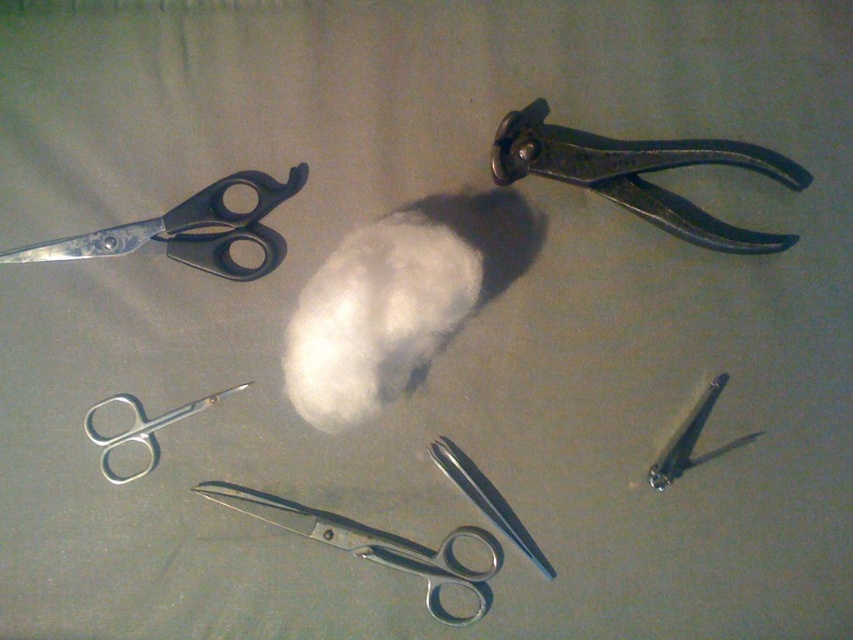
Can you confirm if dark gray metal pliers at upper right is bigger than silver metallic scissors at upper left?

Correct, dark gray metal pliers at upper right is larger in size than silver metallic scissors at upper left.

Between point (612, 177) and point (142, 420), which one is positioned in front?

Point (612, 177)

Which is in front, point (497, 161) or point (155, 417)?

Point (155, 417)

This screenshot has width=853, height=640. Identify the location of dark gray metal pliers at upper right. (639, 173).

From the picture: Does silver metallic scissors at upper left have a larger size compared to metallic silver nail at center?

Correct, silver metallic scissors at upper left is larger in size than metallic silver nail at center.

Is point (154, 440) behind point (677, 448)?

Yes, point (154, 440) is farther from viewer.

Describe the element at coordinates (142, 428) in the screenshot. I see `silver metallic scissors at upper left` at that location.

This screenshot has height=640, width=853. I want to click on silver metallic scissors at upper left, so click(x=142, y=428).

Between dark gray metal pliers at upper right and metallic scissors at center, which one has more height?

With more height is dark gray metal pliers at upper right.

Can you confirm if dark gray metal pliers at upper right is positioned to the right of metallic scissors at center?

Yes, dark gray metal pliers at upper right is to the right of metallic scissors at center.

Where is `dark gray metal pliers at upper right`? The image size is (853, 640). dark gray metal pliers at upper right is located at coordinates (639, 173).